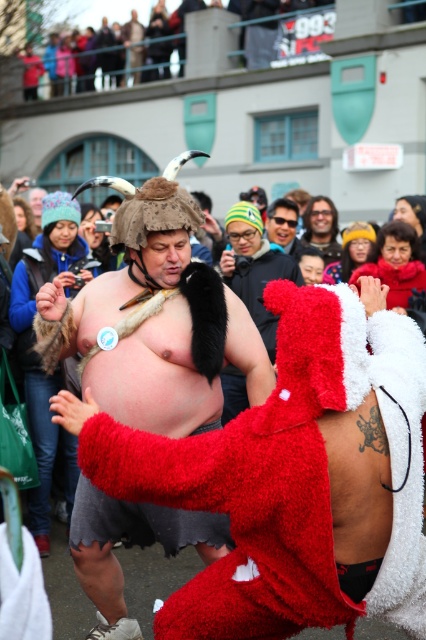
Consider the image. You are a photographer at the event and need to position yourself to capture both the fuzzy red robe at center and the person with the brown hat and horns on the left. Where should you stand to ensure both are in frame?

To capture both the fuzzy red robe at center and the person with the brown hat and horns on the left, position yourself centrally so that both subjects are within your camera frame.

You are a photographer at the event and want to capture a photo where both the fuzzy red robe at center and the matte black sunglasses at center are clearly visible. Do you need to adjust your camera angle to ensure both are in frame?

The fuzzy red robe at center is in front of the matte black sunglasses at center, so adjusting the camera angle slightly might be necessary to ensure both are visible without one blocking the other.

You are a photographer trying to capture a clear photo of both the fuzzy red santa at center and the shiny black hair at center. Since the camera can only focus on one object at a time, which one should you choose to ensure the other remains somewhat in focus?

The fuzzy red santa at center is closer to the viewer than the shiny black hair at center. By focusing on the fuzzy red santa at center, the depth of field may include the shiny black hair at center in relative focus, making it a better choice for capturing both subjects.